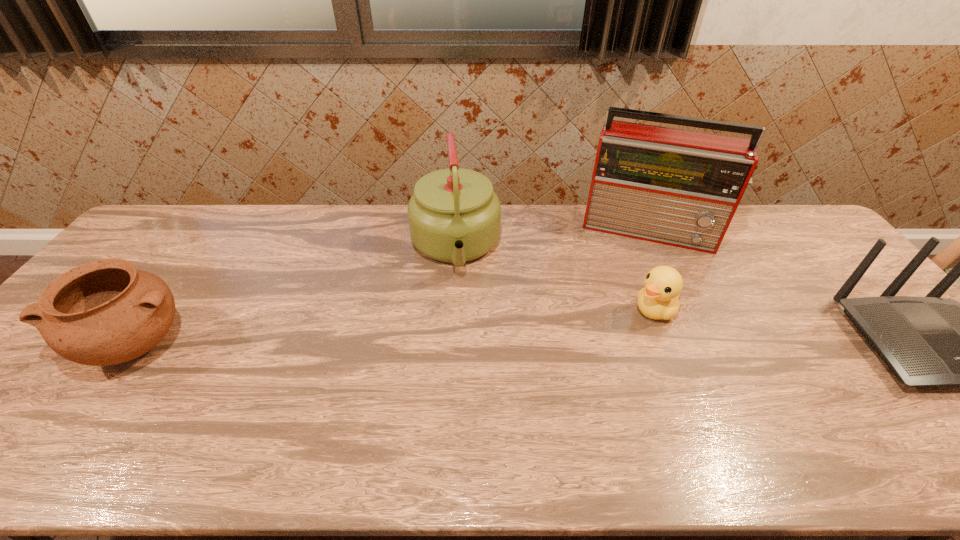
You are a GUI agent. You are given a task and a screenshot of the screen. Output one action in this format:
    pyautogui.click(x=<x>, y=<y>)
    Task: Click on the free space located 0.320m on the front-facing side of the radio receiver
    This screenshot has width=960, height=540.
    Given the screenshot: What is the action you would take?
    pyautogui.click(x=628, y=326)

You are a GUI agent. You are given a task and a screenshot of the screen. Output one action in this format:
    pyautogui.click(x=<x>, y=<y>)
    Task: Click on the blank space located 0.390m on the front-facing side of the radio receiver
    The image size is (960, 540).
    Given the screenshot: What is the action you would take?
    pyautogui.click(x=625, y=346)

At what (x,y) coordinates should I click in order to perform the action: click on vacant region located 0.360m at the spout of the kettle. Please return your answer as a coordinate pair (x, y). Looking at the image, I should click on 469,397.

Where is `free space located 0.310m at the spout of the kettle`? The height and width of the screenshot is (540, 960). free space located 0.310m at the spout of the kettle is located at coordinates (468, 379).

The width and height of the screenshot is (960, 540). In order to click on free space located at the spout of the kettle in this screenshot , I will do (460, 306).

Locate an element on the screen. radio receiver that is at the far edge is located at coordinates (677, 187).

The height and width of the screenshot is (540, 960). What are the coordinates of `kettle that is at the far edge` in the screenshot? It's located at (454, 215).

At what (x,y) coordinates should I click in order to perform the action: click on object situated at the near edge. Please return your answer as a coordinate pair (x, y). Looking at the image, I should click on (105, 312).

Identify the location of object at the left edge. (105, 312).

Where is `object that is at the near left corner`? The image size is (960, 540). object that is at the near left corner is located at coordinates (105, 312).